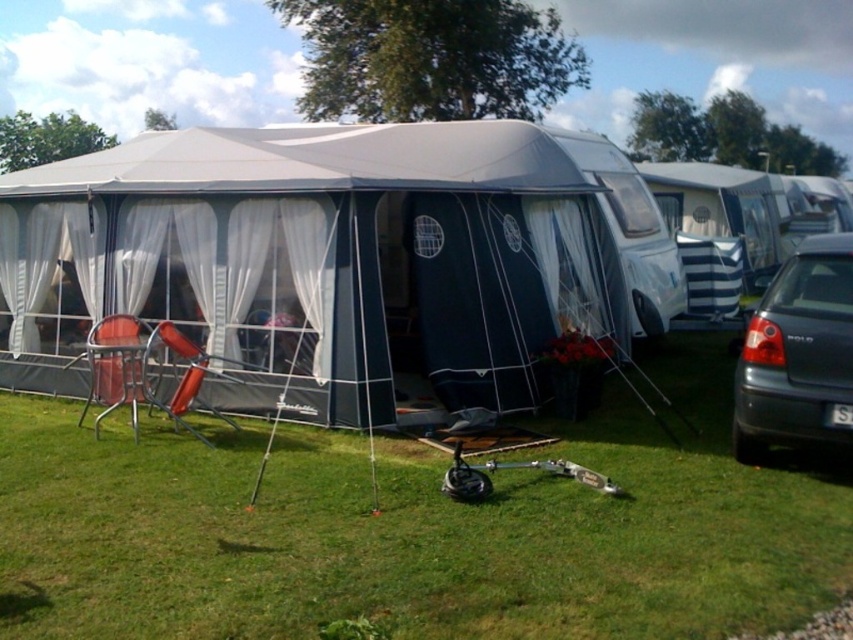
Question: Can you confirm if matte gray tent at center is bigger than dark gray metallic car at right?

Choices:
 (A) yes
 (B) no

Answer: (A)

Question: Which of the following is the closest to the observer?

Choices:
 (A) (387, 461)
 (B) (201, 160)
 (C) (780, 330)

Answer: (C)

Question: Which object is positioned closest to the dark gray metallic car at right?

Choices:
 (A) green grass at lower center
 (B) matte gray tent at center

Answer: (A)

Question: Is matte gray tent at center further to the viewer compared to dark gray metallic car at right?

Choices:
 (A) yes
 (B) no

Answer: (A)

Question: Which point is closer to the camera taking this photo?

Choices:
 (A) (10, 548)
 (B) (786, 440)
 (C) (496, 364)

Answer: (A)

Question: Can you confirm if green grass at lower center is thinner than dark gray metallic car at right?

Choices:
 (A) no
 (B) yes

Answer: (A)